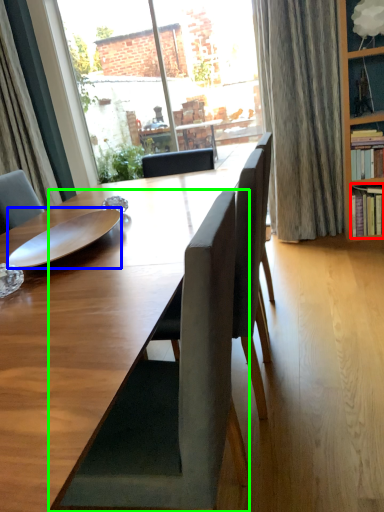
Question: Which object is positioned farthest from shelf (highlighted by a red box)? Select from plate (highlighted by a blue box) and chair (highlighted by a green box).

Choices:
 (A) plate
 (B) chair

Answer: (B)